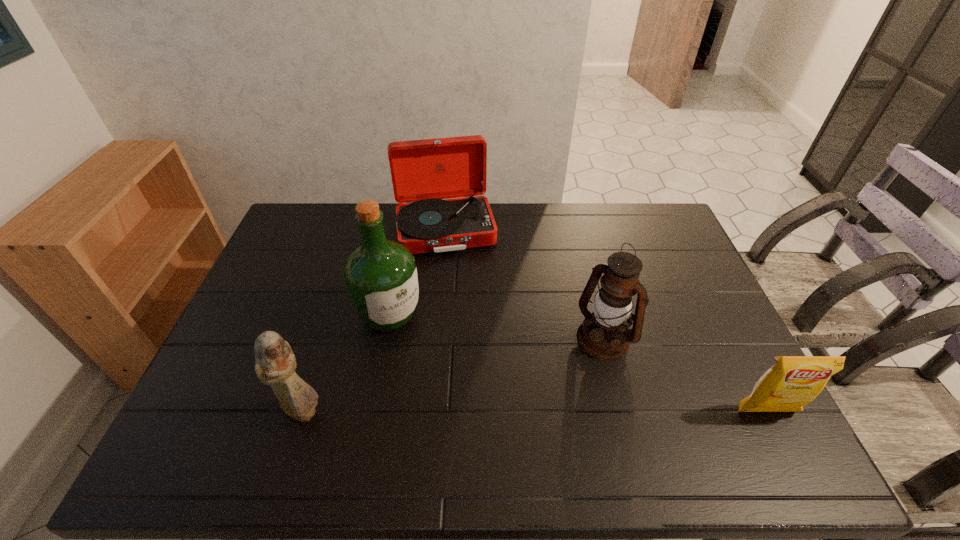
The image size is (960, 540). I want to click on object at the near right corner, so click(x=793, y=381).

You are a GUI agent. You are given a task and a screenshot of the screen. Output one action in this format:
    pyautogui.click(x=<x>, y=<y>)
    Task: Click on the free spot at the far edge of the desktop
    
    Given the screenshot: What is the action you would take?
    pyautogui.click(x=382, y=208)

The image size is (960, 540). Find the location of `blank space at the near edge`. blank space at the near edge is located at coordinates (559, 403).

Where is `free space at the left edge of the desktop`? This screenshot has width=960, height=540. free space at the left edge of the desktop is located at coordinates (238, 321).

Locate an element on the screen. This screenshot has height=540, width=960. free location at the right edge of the desktop is located at coordinates (645, 267).

Find the location of a particular element. The height and width of the screenshot is (540, 960). vacant position at the far left corner of the desktop is located at coordinates (302, 224).

Where is `vacant area between the liquor and the shortest object`? This screenshot has width=960, height=540. vacant area between the liquor and the shortest object is located at coordinates (578, 363).

The height and width of the screenshot is (540, 960). In order to click on blank region between the leftmost object and the fourth object from left to right in this screenshot , I will do `click(453, 375)`.

Image resolution: width=960 pixels, height=540 pixels. Find the location of `free space between the figurine and the liquor`. free space between the figurine and the liquor is located at coordinates (347, 363).

The width and height of the screenshot is (960, 540). Find the location of `vacant area that lies between the leftmost object and the fourth object from left to right`. vacant area that lies between the leftmost object and the fourth object from left to right is located at coordinates [x=453, y=375].